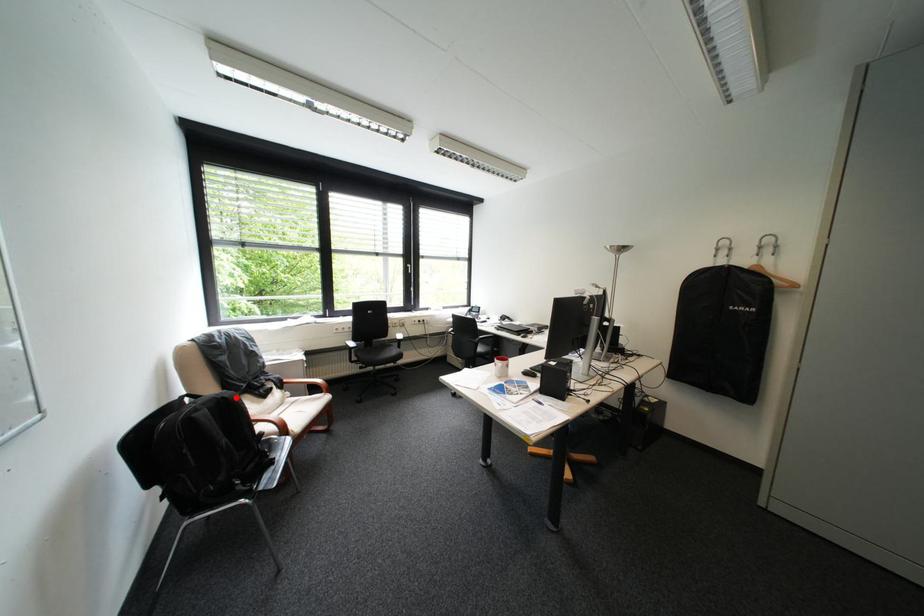
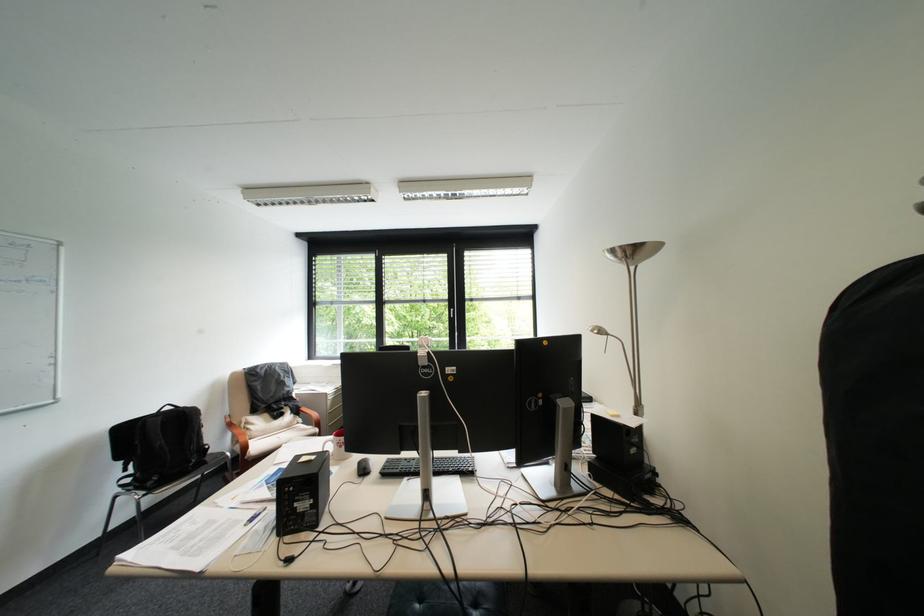
In the second image, find the point that corresponds to the highlighted location in the first image.

(198, 411)